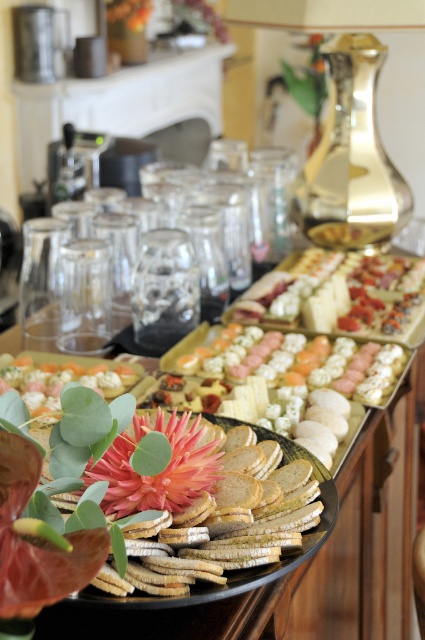
You are a photographer adjusting your camera settings to capture the buffet. You need to focus on the sliced cheese at center. Given that the camera is currently 1.29 meters away from the cheese, what adjustment should you make to ensure the cheese is in sharp focus?

Since the camera is 1.29 meters away from the sliced cheese at center, you should set the focus distance to approximately 1.29 meters to ensure the cheese is sharply focused in the photograph.

You are a guest at the buffet and want to place a small piece of the sliced cheese at center onto the white cracker at center. Based on their sizes, will the cheese fit entirely on the cracker?

The sliced cheese at center is wider than the white cracker at center, so the cheese will not fit entirely on the cracker.

You are a guest at the buffet and want to reach the white crumbly cheese at center without moving the sliced cheese at center. How can you access it?

The white crumbly cheese at center is behind the sliced cheese at center, so you can access it by moving around the front side of the sliced cheese at center to reach the white crumbly cheese at center without disturbing it.